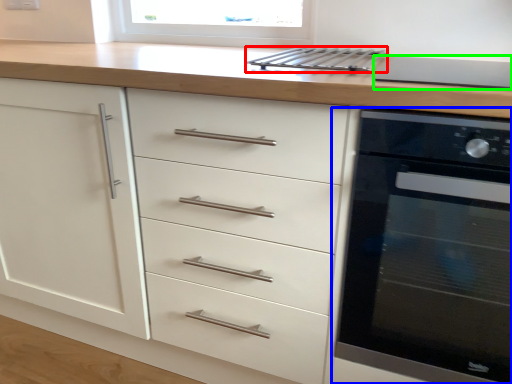
Question: Estimate the real-world distances between objects in this image. Which object is farther from kitchen appliance (highlighted by a red box), home appliance (highlighted by a blue box) or appliance (highlighted by a green box)?

Choices:
 (A) home appliance
 (B) appliance

Answer: (A)